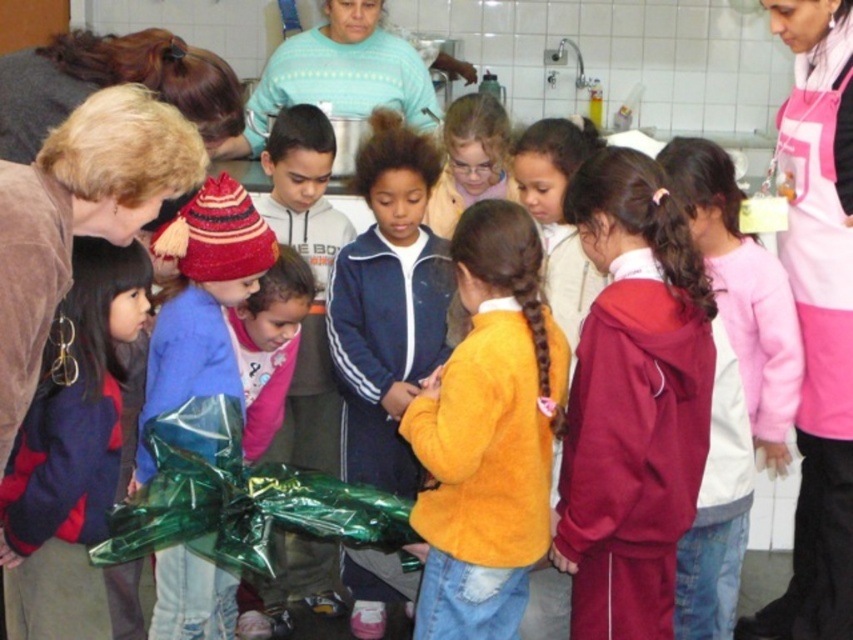
Is pink apron at right further to camera compared to shiny green wrapping paper at center?

Yes, pink apron at right is further from the viewer.

Is point (795, 422) closer to viewer compared to point (167, 372)?

No, it is behind (167, 372).

You are a GUI agent. You are given a task and a screenshot of the screen. Output one action in this format:
    pyautogui.click(x=<x>, y=<y>)
    Task: Click on the pink apron at right
    
    Given the screenshot: What is the action you would take?
    pyautogui.click(x=817, y=316)

Does maroon fleece jacket at center appear over pink apron at right?

Incorrect, maroon fleece jacket at center is not positioned above pink apron at right.

Is maroon fleece jacket at center taller than pink apron at right?

No, maroon fleece jacket at center is not taller than pink apron at right.

Is point (635, 385) less distant than point (838, 4)?

Yes, it is in front of point (838, 4).

Identify the location of maroon fleece jacket at center. Image resolution: width=853 pixels, height=640 pixels. (631, 401).

Which is behind, point (608, 499) or point (172, 408)?

The point (172, 408) is more distant.

Who is positioned more to the right, maroon fleece jacket at center or shiny green wrapping paper at center?

Positioned to the right is maroon fleece jacket at center.

Is point (592, 538) more distant than point (233, 282)?

That is False.

At what (x,y) coordinates should I click in order to perform the action: click on maroon fleece jacket at center. Please return your answer as a coordinate pair (x, y). Image resolution: width=853 pixels, height=640 pixels. Looking at the image, I should click on (631, 401).